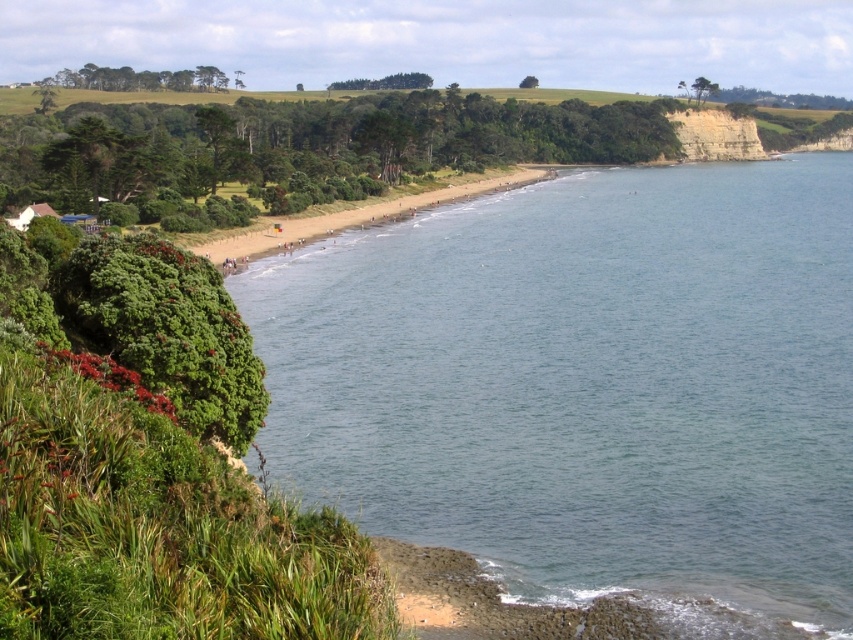
Question: Which point is farther to the camera?

Choices:
 (A) light beige sandstone cliff at upper right
 (B) clear blue water at center

Answer: (A)

Question: Is clear blue water at center bigger than light beige sandstone cliff at upper right?

Choices:
 (A) yes
 (B) no

Answer: (A)

Question: Which point is farther to the camera?

Choices:
 (A) (730, 156)
 (B) (621, 316)

Answer: (A)

Question: In this image, where is clear blue water at center located relative to light beige sandstone cliff at upper right?

Choices:
 (A) left
 (B) right

Answer: (A)

Question: Where is clear blue water at center located in relation to light beige sandstone cliff at upper right in the image?

Choices:
 (A) below
 (B) above

Answer: (A)